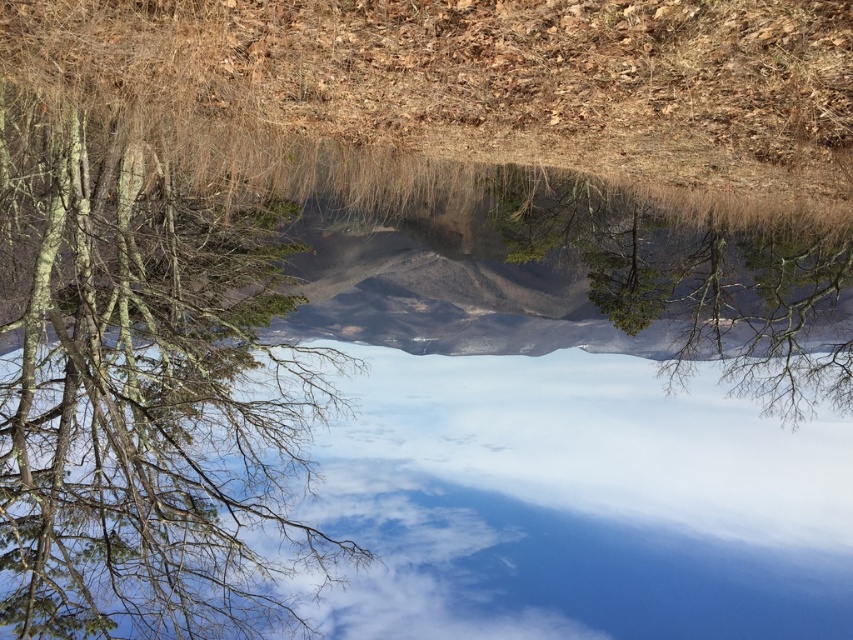
Question: Does barky brown tree at left appear over green matte tree at center?

Choices:
 (A) no
 (B) yes

Answer: (A)

Question: Is barky brown tree at left to the left of cloudy sky at center from the viewer's perspective?

Choices:
 (A) yes
 (B) no

Answer: (A)

Question: Which point is farther to the camera?

Choices:
 (A) (22, 284)
 (B) (705, 268)

Answer: (B)

Question: Which point is closer to the camera?

Choices:
 (A) (573, 188)
 (B) (285, 532)

Answer: (B)

Question: In this image, where is barky brown tree at left located relative to green matte tree at center?

Choices:
 (A) left
 (B) right

Answer: (A)

Question: Which point is farther to the camera?

Choices:
 (A) (247, 324)
 (B) (682, 392)

Answer: (B)